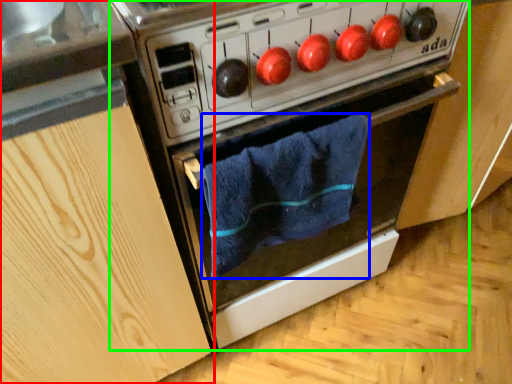
Question: Which is farther away from cabinetry (highlighted by a red box)? bath towel (highlighted by a blue box) or oven (highlighted by a green box)?

Choices:
 (A) bath towel
 (B) oven

Answer: (A)